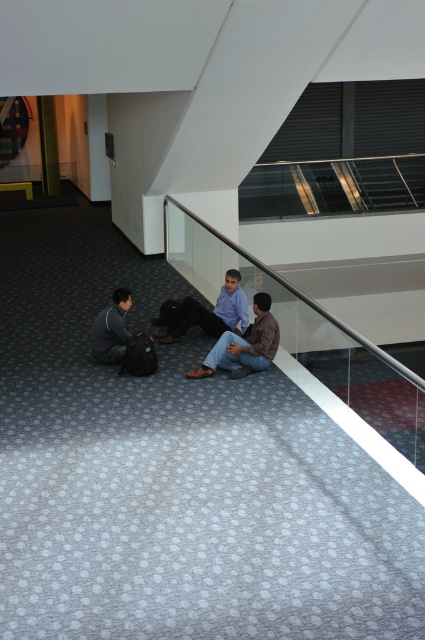
You are a delivery person who needs to place a package between the brown leather jacket at center and the dark gray fabric jacket at lower left. The package is 5 feet long. Can you fit it between them?

The distance between the brown leather jacket at center and the dark gray fabric jacket at lower left is 4.74 feet. Since the package is 5 feet long, it is slightly longer than the available space. Therefore, the package cannot be placed between them without overlapping the jackets.

You are a photographer standing at the camera position. You want to take a closeup shot of the brown leather jacket at center. Is the jacket within your camera range if your camera can focus up to 5 meters?

The brown leather jacket at center is 7.53 meters away from camera, which is beyond the camera focus range of 5 meters. Therefore, the jacket is out of focus range.